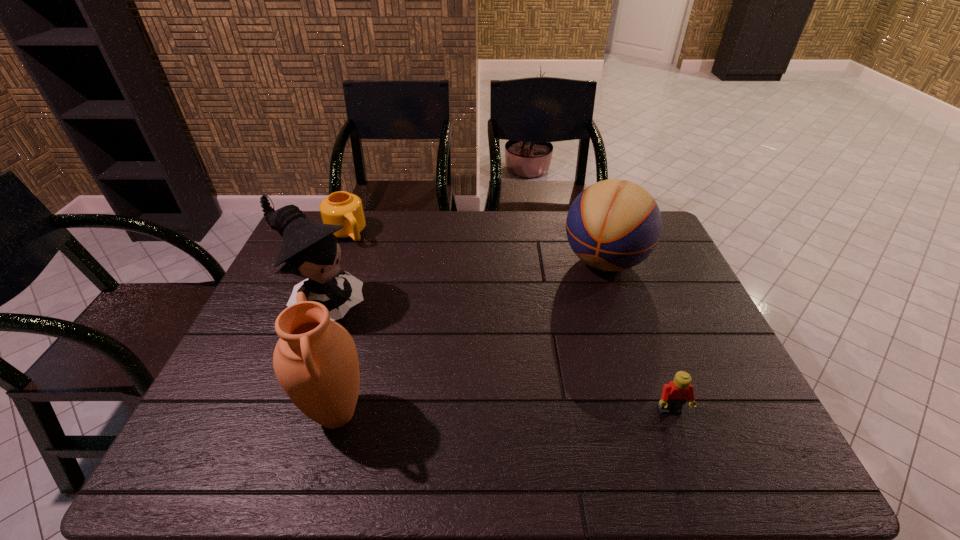
What are the coordinates of `empty space between the urn and the Lego` in the screenshot? It's located at (503, 413).

Point out which object is positioned as the third nearest to the basketball. Please provide its 2D coordinates. Your answer should be formatted as a tuple, i.e. [(x, y)], where the tuple contains the x and y coordinates of a point satisfying the conditions above.

[(315, 360)]

Choose which object is the third nearest neighbor to the Lego. Please provide its 2D coordinates. Your answer should be formatted as a tuple, i.e. [(x, y)], where the tuple contains the x and y coordinates of a point satisfying the conditions above.

[(310, 250)]

Image resolution: width=960 pixels, height=540 pixels. Identify the location of vacant space that satisfies the following two spatial constraints: 1. on the front side of the urn; 2. on the left side of the doll. (282, 414).

Where is `vacant space that satisfies the following two spatial constraints: 1. on the front side of the mug; 2. on the right side of the doll`? This screenshot has width=960, height=540. vacant space that satisfies the following two spatial constraints: 1. on the front side of the mug; 2. on the right side of the doll is located at coordinates (318, 306).

Identify the location of vacant space that satisfies the following two spatial constraints: 1. on the front side of the basketball; 2. on the left side of the mug. Image resolution: width=960 pixels, height=540 pixels. (335, 261).